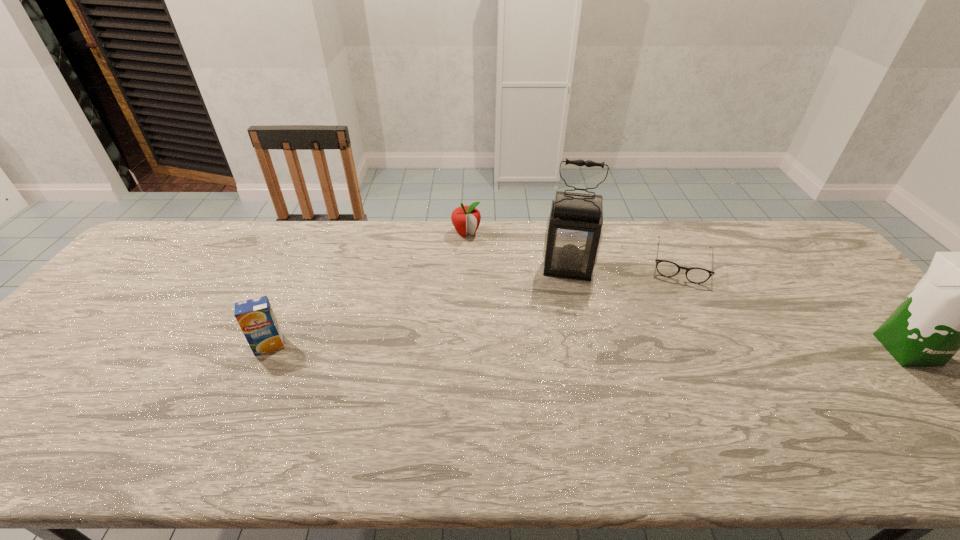
Locate an element on the screen. orange_juice is located at coordinates (256, 318).

At what (x,y) coordinates should I click in order to perform the action: click on the third shortest object. Please return your answer as a coordinate pair (x, y). The image size is (960, 540). Looking at the image, I should click on (256, 318).

The height and width of the screenshot is (540, 960). In order to click on the fourth shortest object in this screenshot , I will do `click(959, 303)`.

The height and width of the screenshot is (540, 960). What are the coordinates of `soya milk` in the screenshot? It's located at (959, 303).

You are a GUI agent. You are given a task and a screenshot of the screen. Output one action in this format:
    pyautogui.click(x=<x>, y=<y>)
    Task: Click on the fourth object from right to left
    The width and height of the screenshot is (960, 540).
    Given the screenshot: What is the action you would take?
    pyautogui.click(x=466, y=219)

Find the location of a particular element. The image size is (960, 540). the fourth tallest object is located at coordinates (466, 219).

At what (x,y) coordinates should I click in order to perform the action: click on the tallest object. Please return your answer as a coordinate pair (x, y). Looking at the image, I should click on (573, 235).

Where is `lantern`? Image resolution: width=960 pixels, height=540 pixels. lantern is located at coordinates (573, 235).

Locate an element on the screen. The height and width of the screenshot is (540, 960). the shortest object is located at coordinates (695, 275).

You are a GUI agent. You are given a task and a screenshot of the screen. Output one action in this format:
    pyautogui.click(x=<x>, y=<y>)
    Task: Click on the spectacles
    The height and width of the screenshot is (540, 960).
    Given the screenshot: What is the action you would take?
    pyautogui.click(x=695, y=275)